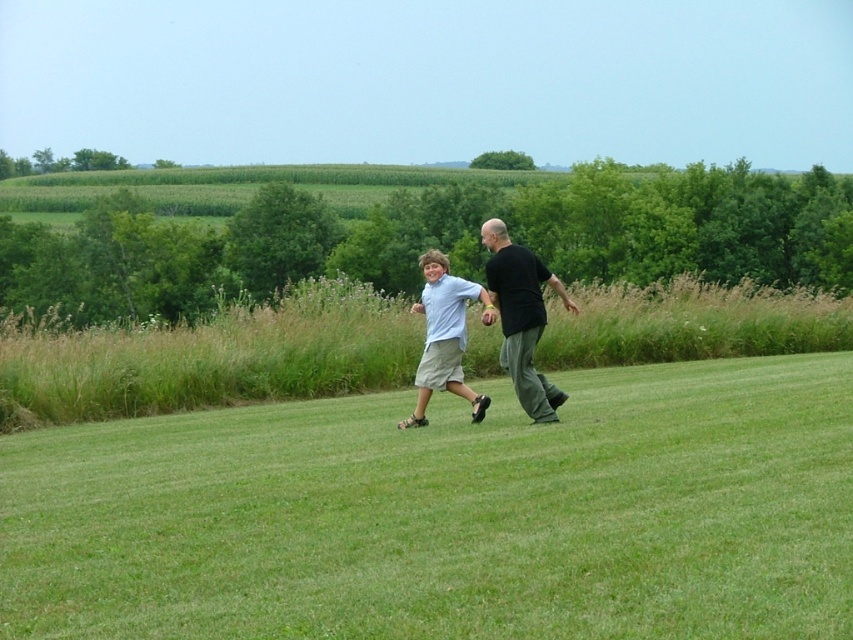
You are a photographer trying to capture a photo of the black matte shirt at center while ensuring the green grassy field at center is visible in the background. Based on their positions, will you need to adjust your camera angle upwards or downwards to achieve this composition?

The green grassy field at center is located below the black matte shirt at center, so to have the black matte shirt at center in the foreground and the green grassy field at center in the background, you would need to angle your camera upwards.